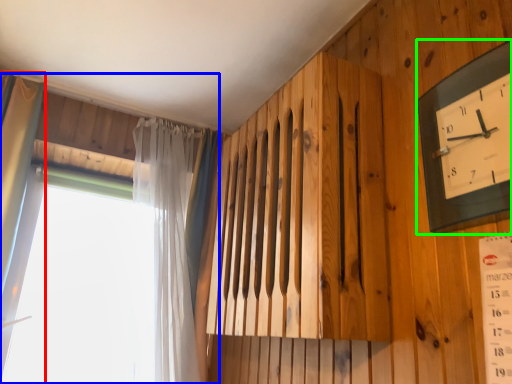
Question: Which object is positioned closest to curtain (highlighted by a red box)? Select from window (highlighted by a blue box) and wall clock (highlighted by a green box).

Choices:
 (A) window
 (B) wall clock

Answer: (A)